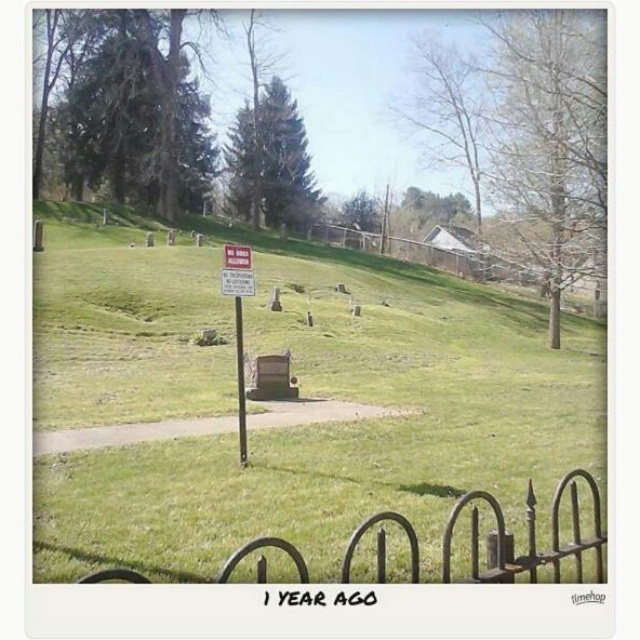
Question: Is iron fence at lower center below white plastic sign at center?

Choices:
 (A) yes
 (B) no

Answer: (A)

Question: Which object is farther from the camera taking this photo?

Choices:
 (A) green grassy at center
 (B) iron fence at lower center

Answer: (A)

Question: Does iron fence at lower center have a smaller size compared to white plastic sign at center?

Choices:
 (A) yes
 (B) no

Answer: (B)

Question: Which of the following is the closest to the observer?

Choices:
 (A) (221, 273)
 (B) (529, 481)

Answer: (B)

Question: Among these objects, which one is farthest from the camera?

Choices:
 (A) white plastic sign at center
 (B) green grassy at center

Answer: (A)

Question: Does green grassy at center appear on the left side of white plastic sign at center?

Choices:
 (A) no
 (B) yes

Answer: (B)